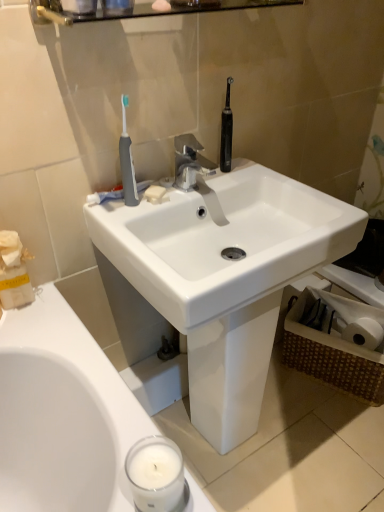
Question: From a real-world perspective, is gray rubber toothbrush at upper left beneath glossy glass shelf at upper center?

Choices:
 (A) no
 (B) yes

Answer: (B)

Question: Does gray rubber toothbrush at upper left appear on the left side of glossy glass shelf at upper center?

Choices:
 (A) yes
 (B) no

Answer: (A)

Question: Is gray rubber toothbrush at upper left positioned behind glossy glass shelf at upper center?

Choices:
 (A) no
 (B) yes

Answer: (B)

Question: Can you confirm if gray rubber toothbrush at upper left is positioned to the right of glossy glass shelf at upper center?

Choices:
 (A) no
 (B) yes

Answer: (A)

Question: Is gray rubber toothbrush at upper left positioned with its back to glossy glass shelf at upper center?

Choices:
 (A) no
 (B) yes

Answer: (A)

Question: Considering the positions of glossy glass shelf at upper center and white glossy sink at center in the image, is glossy glass shelf at upper center taller or shorter than white glossy sink at center?

Choices:
 (A) short
 (B) tall

Answer: (A)

Question: Is glossy glass shelf at upper center in front of or behind white glossy sink at center in the image?

Choices:
 (A) front
 (B) behind

Answer: (A)

Question: Considering the relative positions of glossy glass shelf at upper center and white glossy sink at center in the image provided, is glossy glass shelf at upper center to the left or to the right of white glossy sink at center?

Choices:
 (A) right
 (B) left

Answer: (B)

Question: From the image's perspective, relative to white glossy sink at center, is glossy glass shelf at upper center above or below?

Choices:
 (A) above
 (B) below

Answer: (A)

Question: From a real-world perspective, is white paper tissue at upper left above or below white matte soap at sink center?

Choices:
 (A) below
 (B) above

Answer: (A)

Question: Considering the positions of white paper tissue at upper left and white matte soap at sink center in the image, is white paper tissue at upper left taller or shorter than white matte soap at sink center?

Choices:
 (A) tall
 (B) short

Answer: (A)

Question: Is white paper tissue at upper left inside the boundaries of white matte soap at sink center, or outside?

Choices:
 (A) inside
 (B) outside

Answer: (B)

Question: In terms of size, does white paper tissue at upper left appear bigger or smaller than white matte soap at sink center?

Choices:
 (A) small
 (B) big

Answer: (B)

Question: Based on their sizes in the image, would you say gray rubber toothbrush at upper left is bigger or smaller than white glossy sink at center?

Choices:
 (A) big
 (B) small

Answer: (B)

Question: From their relative heights in the image, would you say gray rubber toothbrush at upper left is taller or shorter than white glossy sink at center?

Choices:
 (A) short
 (B) tall

Answer: (A)